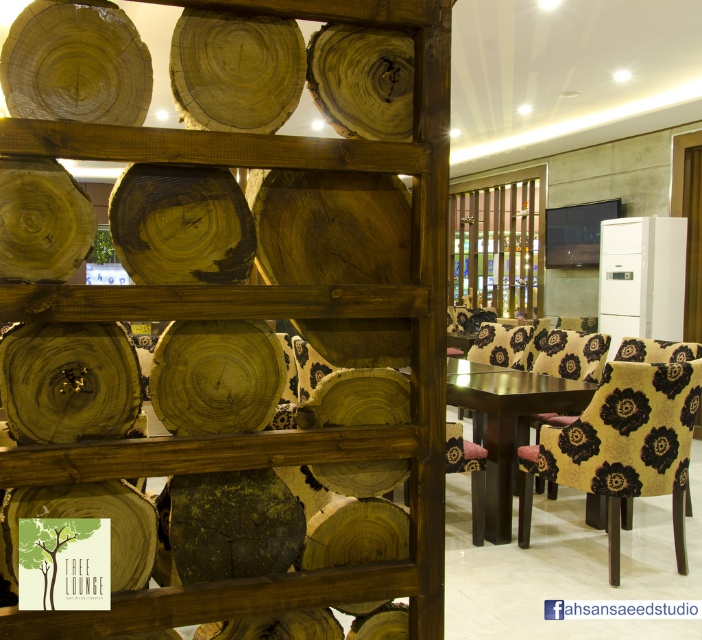
Question: Can you confirm if wooden textured shelf at left is positioned above dark brown wooden table at center?

Choices:
 (A) yes
 (B) no

Answer: (A)

Question: Can you confirm if wooden textured shelf at left is positioned to the right of yellow floral fabric chair at right?

Choices:
 (A) no
 (B) yes

Answer: (A)

Question: Which of the following is the farthest from the observer?

Choices:
 (A) dark brown wooden table at center
 (B) patterned fabric chair at center
 (C) wooden textured shelf at left
 (D) yellow floral fabric chair at right

Answer: (B)

Question: Which object is closer to the camera taking this photo?

Choices:
 (A) dark brown wooden table at center
 (B) wooden textured shelf at left

Answer: (B)

Question: Which point is farther to the camera?

Choices:
 (A) (472, 355)
 (B) (439, 204)
 (C) (524, 396)
 (D) (597, 458)

Answer: (A)

Question: Is wooden textured shelf at left wider than dark brown wooden table at center?

Choices:
 (A) yes
 (B) no

Answer: (A)